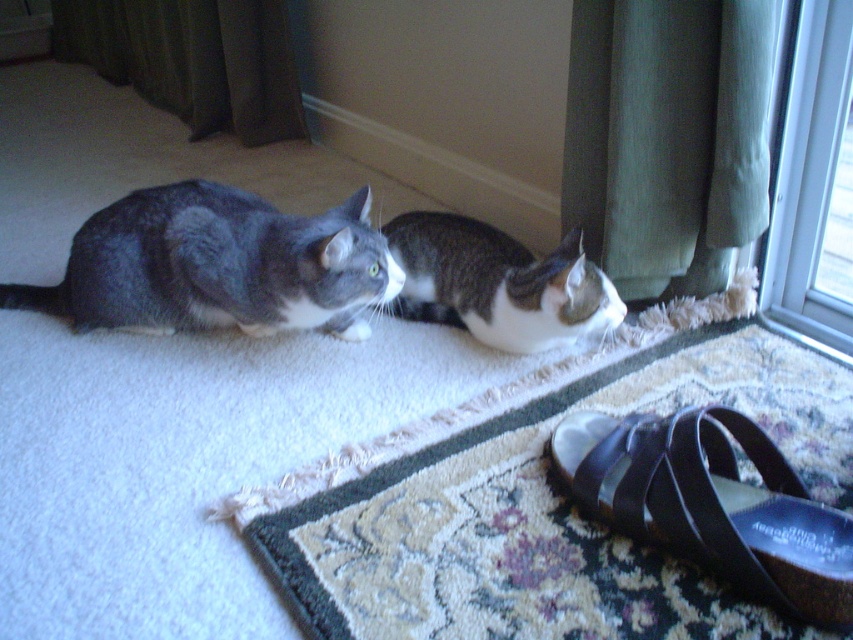
You are standing in the room and want to know how far you are from the point marked at coordinates (x=206, y=51). Can you determine the distance?

The distance between you and the point marked at coordinates (x=206, y=51) is 8.83 feet.